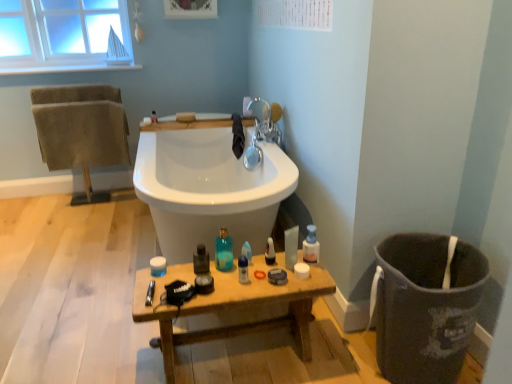
Locate an element on the screen. The image size is (512, 384). free spot to the right of translucent plastic spray bottle at center, the 1th cleaning product when ordered from left to right is located at coordinates (274, 268).